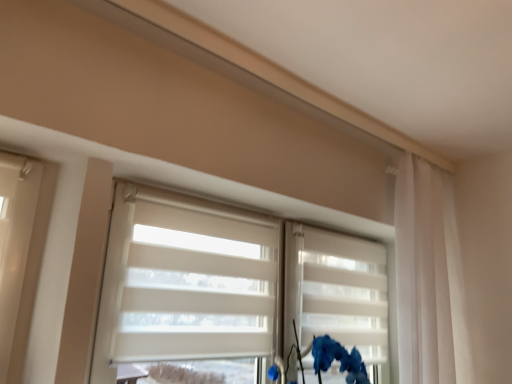
In order to click on white matte shutter at center in this screenshot , I will do `click(336, 291)`.

Find the location of a particular element. Image resolution: width=512 pixels, height=384 pixels. matte blue flower at lower right is located at coordinates (338, 359).

What do you see at coordinates (186, 281) in the screenshot?
I see `white matte blinds at center` at bounding box center [186, 281].

Where is `white sheer curtain at right`? white sheer curtain at right is located at coordinates (429, 278).

Is white matte shutter at center oriented towards white matte blinds at center?

Yes.

Is white matte shutter at center bigger or smaller than white matte blinds at center?

Clearly, white matte shutter at center is smaller in size than white matte blinds at center.

Is point (338, 257) positioned behind point (161, 214)?

Yes, it is.

Based on the photo, from a real-world perspective, is white matte shutter at center on white matte blinds at center?

Correct, in the physical world, white matte shutter at center is higher than white matte blinds at center.

From a real-world perspective, who is located lower, matte blue flower at lower right or white sheer curtain at right?

→ matte blue flower at lower right is physically lower.

Which object is positioned more to the left, matte blue flower at lower right or white sheer curtain at right?

From the viewer's perspective, matte blue flower at lower right appears more on the left side.

Which point is more distant from viewer, (267, 371) or (431, 357)?

Point (431, 357)

Consider the image. Would you say matte blue flower at lower right is a long distance from white sheer curtain at right?

matte blue flower at lower right is near white sheer curtain at right, not far away.

Is white sheer curtain at right surrounding matte blue flower at lower right?

No.

Who is shorter, white sheer curtain at right or matte blue flower at lower right?

matte blue flower at lower right is shorter.

From a real-world perspective, is white sheer curtain at right physically located above or below matte blue flower at lower right?

In terms of real-world spatial position, white sheer curtain at right is above matte blue flower at lower right.

From the picture: Considering the relative positions of white matte shutter at center and white sheer curtain at right in the image provided, is white matte shutter at center to the left of white sheer curtain at right from the viewer's perspective?

Indeed, white matte shutter at center is positioned on the left side of white sheer curtain at right.

Is white matte shutter at center beside white sheer curtain at right?

No, white matte shutter at center is not next to white sheer curtain at right.

Is white matte shutter at center positioned beyond the bounds of white sheer curtain at right?

Yes, white matte shutter at center is not within white sheer curtain at right.

In the image, there is a white sheer curtain at right. In order to click on shutter below it (from a real-world perspective) in this screenshot , I will do `click(336, 291)`.

Between matte blue flower at lower right and white matte shutter at center, which one has less height?

matte blue flower at lower right.

Who is bigger, matte blue flower at lower right or white matte shutter at center?

white matte shutter at center.

Considering the positions of points (300, 353) and (350, 287), is point (300, 353) farther from camera compared to point (350, 287)?

No, it is not.

Is white matte blinds at center aimed at white matte shutter at center?

Yes, white matte blinds at center is turned towards white matte shutter at center.

In terms of height, does white matte blinds at center look taller or shorter compared to white matte shutter at center?

Clearly, white matte blinds at center is taller compared to white matte shutter at center.

Is white matte blinds at center positioned far away from white matte shutter at center?

No, white matte blinds at center is not far from white matte shutter at center.

Between white matte blinds at center and matte blue flower at lower right, which one appears on the right side from the viewer's perspective?

Positioned to the right is matte blue flower at lower right.

I want to click on floral arrangement below the white matte blinds at center (from a real-world perspective), so click(338, 359).

How much distance is there between white matte blinds at center and matte blue flower at lower right?

The distance of white matte blinds at center from matte blue flower at lower right is 38.72 centimeters.

The image size is (512, 384). Identify the location of shutter located behind the white matte blinds at center. (336, 291).

Image resolution: width=512 pixels, height=384 pixels. I want to click on curtain located on the right of matte blue flower at lower right, so click(429, 278).

Based on their spatial positions, is matte blue flower at lower right or white sheer curtain at right closer to white matte blinds at center?

matte blue flower at lower right is positioned closer to the anchor white matte blinds at center.

Considering their positions, is white sheer curtain at right positioned further to white matte blinds at center than matte blue flower at lower right?

The object further to white matte blinds at center is white sheer curtain at right.

Based on their spatial positions, is white matte blinds at center or white matte shutter at center closer to white sheer curtain at right?

white matte shutter at center is positioned closer to the anchor white sheer curtain at right.

Based on their spatial positions, is white matte blinds at center or matte blue flower at lower right further from white matte shutter at center?

Based on the image, white matte blinds at center appears to be further to white matte shutter at center.

Based on the photo, from the image, which object appears to be nearer to white sheer curtain at right, matte blue flower at lower right or white matte shutter at center?

The object closer to white sheer curtain at right is white matte shutter at center.

From the image, which object appears to be farther from white matte blinds at center, white matte shutter at center or matte blue flower at lower right?

matte blue flower at lower right.

Which object lies nearer to the anchor point white sheer curtain at right, white matte shutter at center or matte blue flower at lower right?

white matte shutter at center lies closer to white sheer curtain at right than the other object.

Estimate the real-world distances between objects in this image. Which object is further from matte blue flower at lower right, white sheer curtain at right or white matte blinds at center?

white sheer curtain at right is further to matte blue flower at lower right.

This screenshot has width=512, height=384. Find the location of `shutter between white matte blinds at center and white sheer curtain at right from left to right`. shutter between white matte blinds at center and white sheer curtain at right from left to right is located at coordinates (336, 291).

Identify the location of floral arrangement located between white matte blinds at center and white sheer curtain at right in the left-right direction. Image resolution: width=512 pixels, height=384 pixels. (338, 359).

Where is `shutter located between matte blue flower at lower right and white sheer curtain at right in the left-right direction`? This screenshot has width=512, height=384. shutter located between matte blue flower at lower right and white sheer curtain at right in the left-right direction is located at coordinates (336, 291).

I want to click on floral arrangement between white matte blinds at center and white matte shutter at center along the z-axis, so click(x=338, y=359).